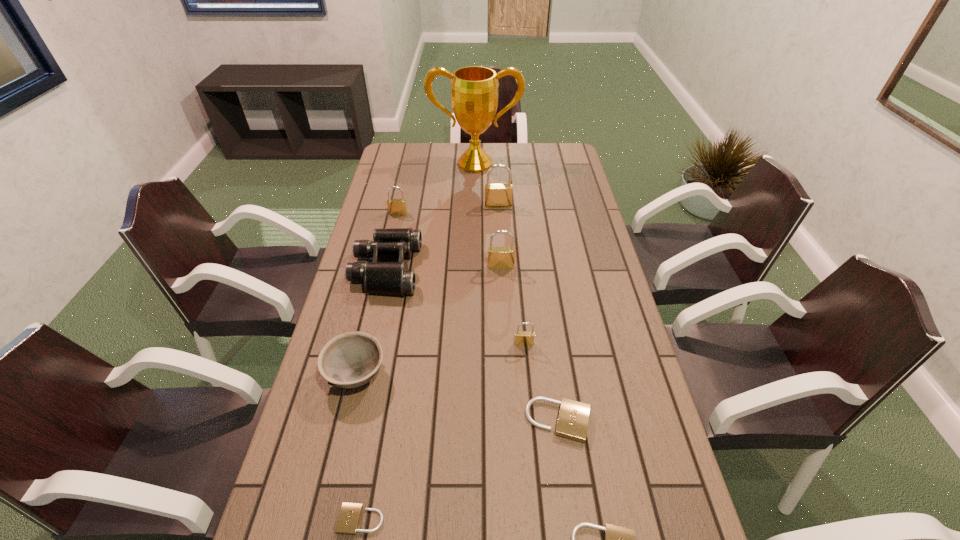
Locate an element on the screen. This screenshot has height=540, width=960. vacant space located 0.300m on the front-facing side of the binoculars is located at coordinates click(510, 269).

Locate an element on the screen. This screenshot has height=540, width=960. vacant area located 0.200m on the front-facing side of the fourth nearest padlock is located at coordinates (530, 412).

Where is `vacant area located on the back of the gray bowl`? vacant area located on the back of the gray bowl is located at coordinates (370, 316).

Locate an element on the screen. Image resolution: width=960 pixels, height=540 pixels. vacant space situated 0.120m on the right of the biggest beige padlock is located at coordinates point(641,421).

Locate an element on the screen. vacant space located on the back of the shortest object is located at coordinates (376, 436).

This screenshot has height=540, width=960. In order to click on object that is positioned at the far edge in this screenshot , I will do `click(474, 89)`.

I want to click on binoculars that is at the left edge, so coord(394,278).

Find the location of a particular element. The image size is (960, 540). bowl positioned at the left edge is located at coordinates (349, 360).

At what (x,y) coordinates should I click in order to perform the action: click on object that is at the right edge. Please return your answer as a coordinate pair (x, y). Image resolution: width=960 pixels, height=540 pixels. Looking at the image, I should click on (573, 418).

Locate an element on the screen. vacant space at the far edge of the desktop is located at coordinates (437, 150).